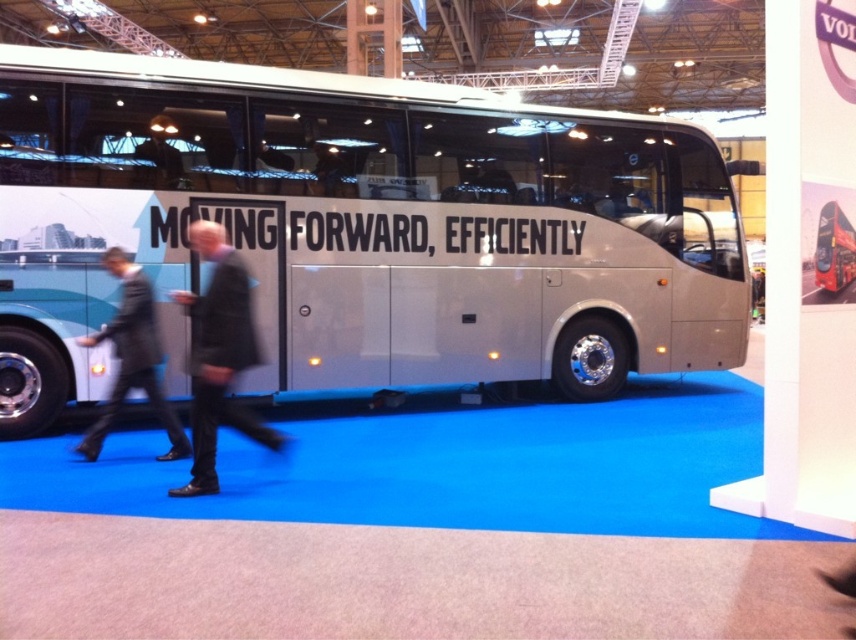
You are a photographer positioned at the back of the exhibition hall. You need to capture a photo of both the white metallic bus at center and the dark gray suit at left. Based on their sizes, which object should you focus on first to ensure both are in frame?

The white metallic bus at center is taller than the dark gray suit at left, so you should focus on the white metallic bus at center first to ensure both are in frame.

In the scene shown: You are an attendee at the exhibition. You want to take a photo of the white metallic bus at center without anyone blocking the view. Is the dark gray suit at left currently blocking your shot?

The dark gray suit at left is behind the white metallic bus at center, so it is not blocking the view. You can take the photo without any obstruction.

You are a photographer standing at the entrance of the exhibition hall. You want to take a photo of the white metallic bus at center without including the dark gray suit at left in the frame. Given that the bus is 8.28 feet away from the suit, what is the minimum distance you need to move away from the bus to ensure the suit is out of the shot?

The white metallic bus at center is 8.28 feet away from the dark gray suit at left. To exclude the dark gray suit at left from the photo, you need to move at least 8.28 feet away from the bus so that the distance between you and the bus is greater than the distance between the bus and the suit.